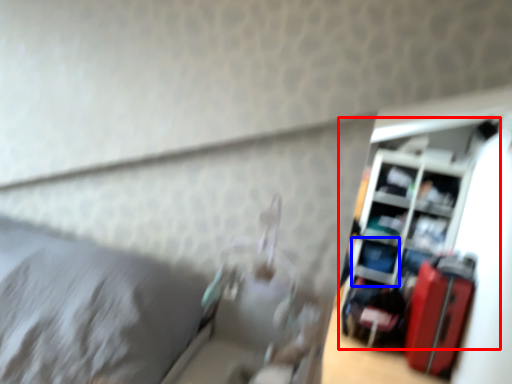
Question: Among these objects, which one is nearest to the camera, shelf (highlighted by a red box) or shelf (highlighted by a blue box)?

Choices:
 (A) shelf
 (B) shelf

Answer: (A)